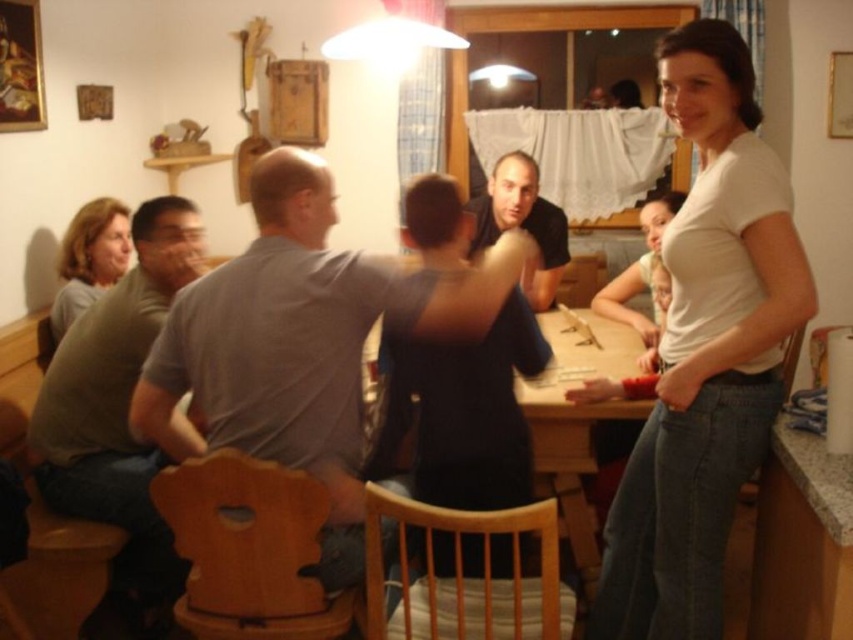
You are a photographer at the event and want to take a photo of the two people wearing the gray matte shirt at center and the matte gray shirt at left. Since you want to include both in the frame, which shirt should you position closer to the camera to ensure both are visible?

The gray matte shirt at center is taller than the matte gray shirt at left, so positioning the gray matte shirt at center closer to the camera will help balance their sizes in the photo.

You are a photographer positioned at the center of the room. You want to capture a photo that includes both the white matte shirt at right and the matte gray shirt at left. Given that your camera has a maximum focus range of 6 feet, will you be able to include both shirts in the same frame without moving closer?

The distance between the white matte shirt at right and the matte gray shirt at left is 6.48 feet. Since the camera can only focus up to 6 feet, the shirts are slightly out of the focus range. Therefore, you won not be able to include both shirts in the same frame without moving closer.